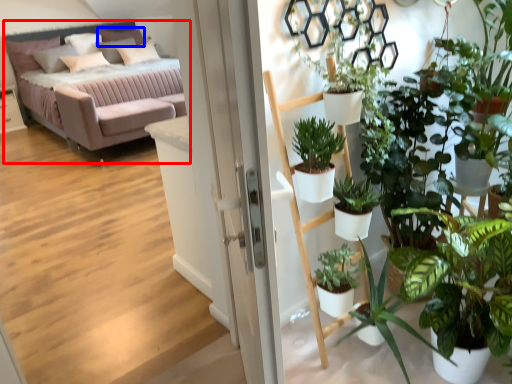
Question: Which object is further to the camera taking this photo, studio couch (highlighted by a red box) or pillow (highlighted by a blue box)?

Choices:
 (A) studio couch
 (B) pillow

Answer: (B)